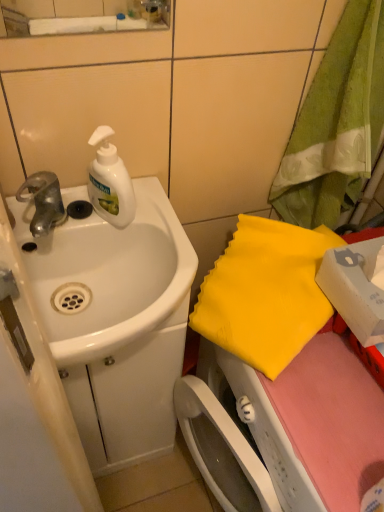
Question: Is yellow fabric at right, the 1th beach towel positioned from the bottom, inside silver metallic faucet at left?

Choices:
 (A) no
 (B) yes

Answer: (A)

Question: From a real-world perspective, is silver metallic faucet at left below yellow fabric at right, the 1th beach towel positioned from the bottom?

Choices:
 (A) yes
 (B) no

Answer: (B)

Question: Is silver metallic faucet at left oriented away from yellow fabric at right, the 1th beach towel positioned from the bottom?

Choices:
 (A) yes
 (B) no

Answer: (B)

Question: Is silver metallic faucet at left wider than yellow fabric at right, the 1th beach towel positioned from the bottom?

Choices:
 (A) no
 (B) yes

Answer: (A)

Question: Is silver metallic faucet at left located outside yellow fabric at right, which ranks as the second beach towel in top-to-bottom order?

Choices:
 (A) yes
 (B) no

Answer: (A)

Question: From the image's perspective, is white matte soap dispenser at upper left positioned above or below yellow fabric at right, which ranks as the second beach towel in top-to-bottom order?

Choices:
 (A) below
 (B) above

Answer: (B)

Question: Considering the relative positions of white matte soap dispenser at upper left and yellow fabric at right, which ranks as the second beach towel in top-to-bottom order, in the image provided, is white matte soap dispenser at upper left to the left or to the right of yellow fabric at right, which ranks as the second beach towel in top-to-bottom order,?

Choices:
 (A) left
 (B) right

Answer: (A)

Question: In terms of height, does white matte soap dispenser at upper left look taller or shorter compared to yellow fabric at right, the 1th beach towel positioned from the bottom?

Choices:
 (A) tall
 (B) short

Answer: (A)

Question: Is white matte soap dispenser at upper left inside the boundaries of yellow fabric at right, the 1th beach towel positioned from the bottom, or outside?

Choices:
 (A) inside
 (B) outside

Answer: (B)

Question: From the image's perspective, is white glossy sink at left positioned above or below green fabric towel at upper right, marked as the first beach towel in a top-to-bottom arrangement?

Choices:
 (A) below
 (B) above

Answer: (A)

Question: In terms of height, does white glossy sink at left look taller or shorter compared to green fabric towel at upper right, which ranks as the 2th beach towel in bottom-to-top order?

Choices:
 (A) tall
 (B) short

Answer: (B)

Question: Would you say white glossy sink at left is to the left or to the right of green fabric towel at upper right, which ranks as the 2th beach towel in bottom-to-top order, in the picture?

Choices:
 (A) right
 (B) left

Answer: (B)

Question: Considering their positions, is white glossy sink at left located in front of or behind green fabric towel at upper right, which ranks as the 2th beach towel in bottom-to-top order?

Choices:
 (A) front
 (B) behind

Answer: (B)

Question: Relative to white glossy sink at left, is yellow fabric at right, the 1th beach towel positioned from the bottom, in front or behind?

Choices:
 (A) front
 (B) behind

Answer: (B)

Question: From the image's perspective, is yellow fabric at right, which ranks as the second beach towel in top-to-bottom order, positioned above or below white glossy sink at left?

Choices:
 (A) above
 (B) below

Answer: (B)